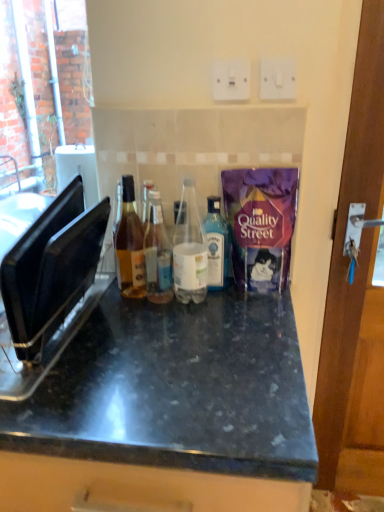
At what (x,y) coordinates should I click in order to perform the action: click on free space on the front side of amber glass bottle at center, the 1th bottle in the left-to-right sequence. Please return your answer as a coordinate pair (x, y). Looking at the image, I should click on (127, 327).